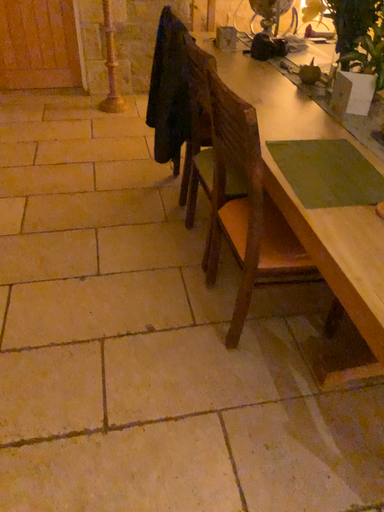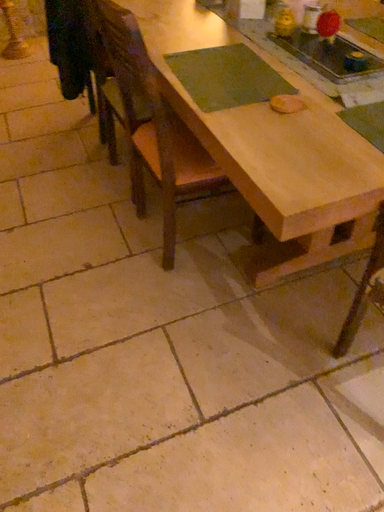
Question: How did the camera likely rotate when shooting the video?

Choices:
 (A) rotated right
 (B) rotated left

Answer: (A)